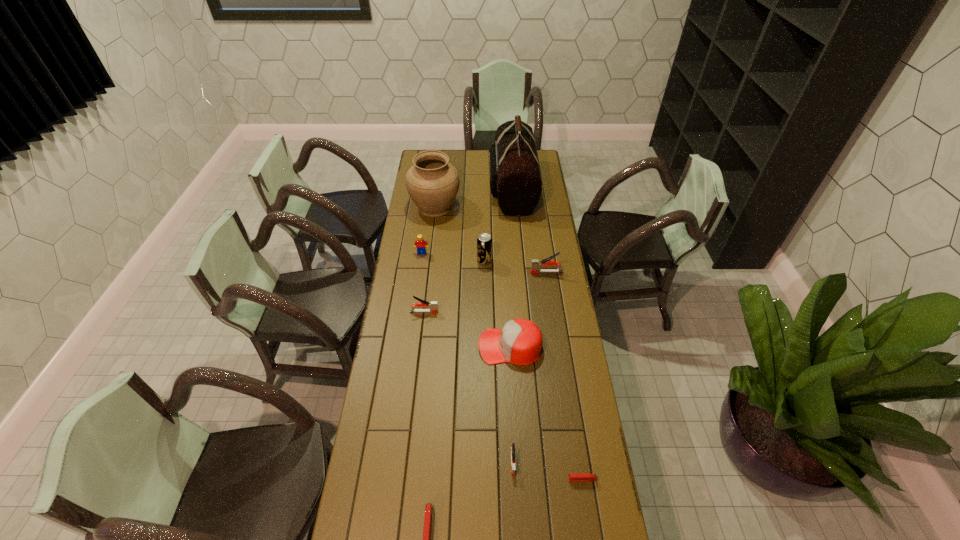
You are a GUI agent. You are given a task and a screenshot of the screen. Output one action in this format:
    pyautogui.click(x=<x>, y=<y>)
    Task: Click on the vacant space located on the right of the urn
    This screenshot has height=540, width=960.
    Given the screenshot: What is the action you would take?
    pyautogui.click(x=483, y=206)

I want to click on vacant area located 0.270m on the front of the fourth farthest object, so click(485, 310).

Where is `free point located 0.090m on the handle side of the fifth farthest object`? free point located 0.090m on the handle side of the fifth farthest object is located at coordinates (511, 272).

Locate an element on the screen. free location located on the handle side of the fifth farthest object is located at coordinates (505, 272).

At what (x,y) coordinates should I click in order to perform the action: click on blank space located on the handle side of the fifth farthest object. Please return your answer as a coordinate pair (x, y). Looking at the image, I should click on (507, 272).

What are the coordinates of `free space located 0.170m on the front-facing side of the red Lego` in the screenshot? It's located at (419, 280).

Where is `vacant region located 0.260m on the front-facing side of the seventh farthest object`? The image size is (960, 540). vacant region located 0.260m on the front-facing side of the seventh farthest object is located at coordinates (414, 346).

The height and width of the screenshot is (540, 960). Find the location of `free point located 0.180m on the front-facing side of the seventh farthest object`. free point located 0.180m on the front-facing side of the seventh farthest object is located at coordinates (433, 346).

In order to click on vacant space located on the front-facing side of the seventh farthest object in this screenshot , I will do `click(383, 346)`.

In order to click on vacant space located 0.250m on the handle side of the leftmost gray stapler in this screenshot , I will do `click(496, 312)`.